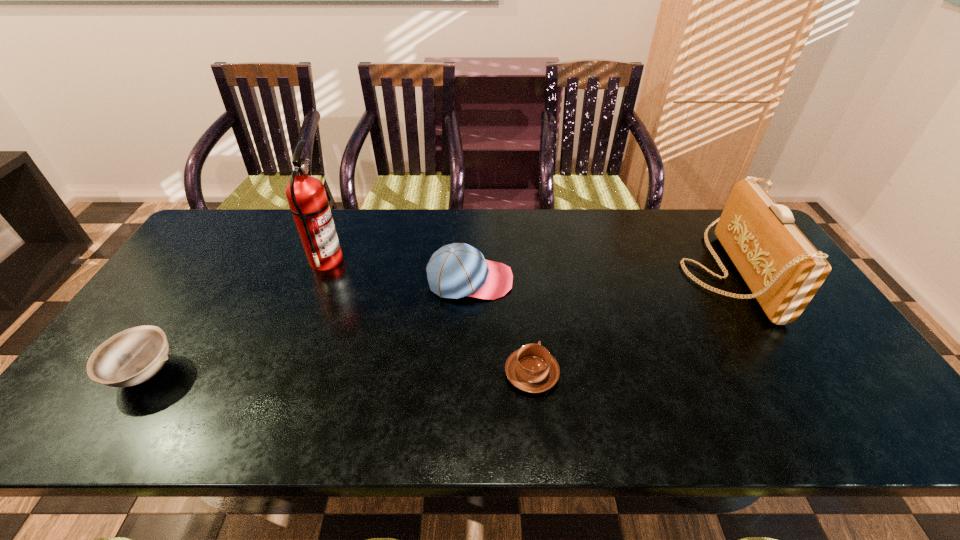
Locate an element on the screen. This screenshot has height=540, width=960. object present at the right edge is located at coordinates (782, 268).

Identify the location of object that is at the far right corner. The height and width of the screenshot is (540, 960). (782, 268).

Find the location of `vacant space at the far edge of the desktop`. vacant space at the far edge of the desktop is located at coordinates (469, 225).

Locate an element on the screen. The height and width of the screenshot is (540, 960). vacant space at the near edge of the desktop is located at coordinates (362, 412).

Where is `free space at the left edge of the desktop`? The image size is (960, 540). free space at the left edge of the desktop is located at coordinates (161, 307).

Where is `free space at the right edge of the desktop`? The height and width of the screenshot is (540, 960). free space at the right edge of the desktop is located at coordinates [x=814, y=344].

In the image, there is a desktop. Identify the location of vacant area at the far left corner. The width and height of the screenshot is (960, 540). (251, 219).

This screenshot has height=540, width=960. What are the coordinates of `empty location between the shortest object and the bowl` in the screenshot? It's located at (338, 373).

Locate an element on the screen. The image size is (960, 540). unoccupied position between the third tallest object and the second object from left to right is located at coordinates (398, 270).

Image resolution: width=960 pixels, height=540 pixels. Identify the location of free space between the rightmost object and the second shortest object. (435, 322).